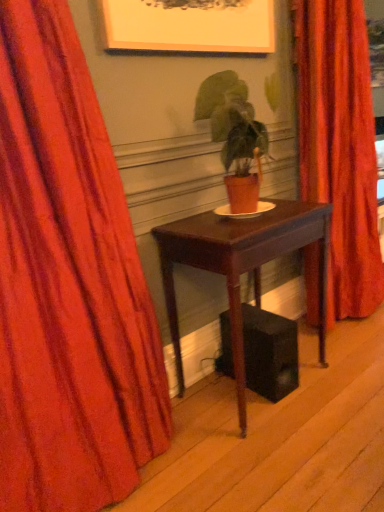
Identify the location of free space to the left of matte orange pot at center. The width and height of the screenshot is (384, 512). (x=188, y=222).